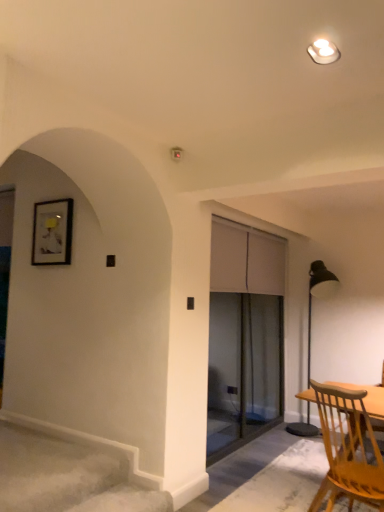
Where is `metallic black floor lamp at right`? The width and height of the screenshot is (384, 512). metallic black floor lamp at right is located at coordinates (319, 294).

Measure the distance between white glossy light fixture at upper center and camera.

The depth of white glossy light fixture at upper center is 1.62 meters.

Image resolution: width=384 pixels, height=512 pixels. What do you see at coordinates (323, 52) in the screenshot? I see `white glossy light fixture at upper center` at bounding box center [323, 52].

The height and width of the screenshot is (512, 384). Identify the location of metallic black floor lamp at right. (319, 294).

Between point (263, 308) and point (310, 278), which one is positioned in front?

The point (310, 278) is in front.

Is transparent glass screen door at center oriented away from metallic black floor lamp at right?

Correct, transparent glass screen door at center is looking away from metallic black floor lamp at right.

Between transparent glass screen door at center and metallic black floor lamp at right, which one is positioned in front?

Positioned in front is transparent glass screen door at center.

Who is smaller, transparent glass screen door at center or metallic black floor lamp at right?

transparent glass screen door at center.

Considering the relative positions of light brown wooden chair at lower right and white glossy light fixture at upper center in the image provided, is light brown wooden chair at lower right to the left of white glossy light fixture at upper center from the viewer's perspective?

Incorrect, light brown wooden chair at lower right is not on the left side of white glossy light fixture at upper center.

Is light brown wooden chair at lower right oriented towards white glossy light fixture at upper center?

No.

From the image's perspective, which object appears higher, light brown wooden chair at lower right or white glossy light fixture at upper center?

white glossy light fixture at upper center, from the image's perspective.

How many degrees apart are the facing directions of metallic black floor lamp at right and white glossy light fixture at upper center?

metallic black floor lamp at right and white glossy light fixture at upper center are facing 0.00351 degrees away from each other.

In terms of width, does metallic black floor lamp at right look wider or thinner when compared to white glossy light fixture at upper center?

Considering their sizes, metallic black floor lamp at right looks broader than white glossy light fixture at upper center.

The height and width of the screenshot is (512, 384). I want to click on lamp on the right of the white glossy light fixture at upper center, so click(x=319, y=294).

Considering the sizes of objects metallic black floor lamp at right and white glossy light fixture at upper center in the image provided, who is shorter, metallic black floor lamp at right or white glossy light fixture at upper center?

Standing shorter between the two is white glossy light fixture at upper center.

Find the location of a particular element. The width and height of the screenshot is (384, 512). lamp behind the transparent glass screen door at center is located at coordinates (319, 294).

Is metallic black floor lamp at right taller than transparent glass screen door at center?

No.

Between metallic black floor lamp at right and transparent glass screen door at center, which one appears on the left side from the viewer's perspective?

transparent glass screen door at center.

Considering their positions, is metallic black floor lamp at right located in front of or behind transparent glass screen door at center?

metallic black floor lamp at right is behind transparent glass screen door at center.

Is transparent glass screen door at center bigger than white glossy light fixture at upper center?

Correct, transparent glass screen door at center is larger in size than white glossy light fixture at upper center.

Is transparent glass screen door at center wider or thinner than white glossy light fixture at upper center?

transparent glass screen door at center is thinner than white glossy light fixture at upper center.

Looking at this image, is transparent glass screen door at center inside the boundaries of white glossy light fixture at upper center, or outside?

transparent glass screen door at center is not enclosed by white glossy light fixture at upper center.

Is transparent glass screen door at center in front of or behind white glossy light fixture at upper center in the image?

transparent glass screen door at center is behind white glossy light fixture at upper center.

Is point (316, 42) in front of point (365, 467)?

Yes, point (316, 42) is closer to viewer.

Is white glossy light fixture at upper center smaller than light brown wooden chair at lower right?

Correct, white glossy light fixture at upper center occupies less space than light brown wooden chair at lower right.

Which is more to the left, white glossy light fixture at upper center or light brown wooden chair at lower right?

Positioned to the left is white glossy light fixture at upper center.

Which object is closer to the camera taking this photo, white glossy light fixture at upper center or metallic black floor lamp at right?

white glossy light fixture at upper center is in front.

From a real-world perspective, which is physically above, white glossy light fixture at upper center or metallic black floor lamp at right?

white glossy light fixture at upper center, from a real-world perspective.

From the image's perspective, which one is positioned lower, white glossy light fixture at upper center or metallic black floor lamp at right?

From the image's view, metallic black floor lamp at right is below.

Considering the positions of point (326, 53) and point (327, 281), is point (326, 53) closer or farther from the camera than point (327, 281)?

Point (326, 53) is positioned closer to the camera compared to point (327, 281).

Locate an element on the screen. lamp located below the transparent glass screen door at center (from the image's perspective) is located at coordinates (319, 294).

The height and width of the screenshot is (512, 384). Identify the location of light fixture in front of the light brown wooden chair at lower right. (323, 52).

When comparing their distances from light brown wooden chair at lower right, does transparent glass screen door at center or white glossy light fixture at upper center seem further?

white glossy light fixture at upper center.

Which object lies nearer to the anchor point metallic black floor lamp at right, light brown wooden chair at lower right or transparent glass screen door at center?

transparent glass screen door at center is closer to metallic black floor lamp at right.

Based on their spatial positions, is metallic black floor lamp at right or light brown wooden chair at lower right further from transparent glass screen door at center?

The object further to transparent glass screen door at center is light brown wooden chair at lower right.

From the image, which object appears to be nearer to transparent glass screen door at center, light brown wooden chair at lower right or metallic black floor lamp at right?

metallic black floor lamp at right.

Considering their positions, is white glossy light fixture at upper center positioned further to transparent glass screen door at center than metallic black floor lamp at right?

white glossy light fixture at upper center lies further to transparent glass screen door at center than the other object.

Looking at the image, which one is located further to white glossy light fixture at upper center, transparent glass screen door at center or light brown wooden chair at lower right?

transparent glass screen door at center is further to white glossy light fixture at upper center.

Looking at this image, estimate the real-world distances between objects in this image. Which object is closer to metallic black floor lamp at right, transparent glass screen door at center or light brown wooden chair at lower right?

transparent glass screen door at center is closer to metallic black floor lamp at right.

Looking at this image, looking at the image, which one is located closer to light brown wooden chair at lower right, transparent glass screen door at center or metallic black floor lamp at right?

Among the two, transparent glass screen door at center is located nearer to light brown wooden chair at lower right.

Find the location of a particular element. The width and height of the screenshot is (384, 512). screen door located between white glossy light fixture at upper center and metallic black floor lamp at right in the depth direction is located at coordinates (244, 335).

This screenshot has width=384, height=512. Find the location of `chair between white glossy light fixture at upper center and metallic black floor lamp at right along the z-axis`. chair between white glossy light fixture at upper center and metallic black floor lamp at right along the z-axis is located at coordinates (348, 449).

Locate an element on the screen. screen door positioned between light brown wooden chair at lower right and metallic black floor lamp at right from near to far is located at coordinates (244, 335).

This screenshot has width=384, height=512. What are the coordinates of `screen door that lies between white glossy light fixture at upper center and light brown wooden chair at lower right from top to bottom` in the screenshot? It's located at (244, 335).